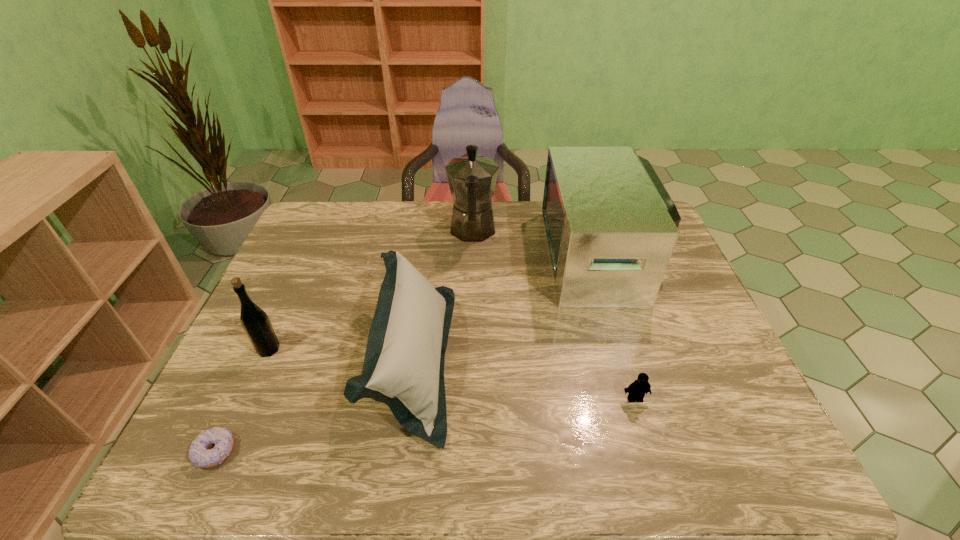
Image resolution: width=960 pixels, height=540 pixels. In order to click on unoccupied area between the beer bottle and the fifth tallest object in this screenshot , I will do `click(452, 374)`.

At what (x,y) coordinates should I click in order to perform the action: click on free space that is in between the Lego and the third shortest object. Please return your answer as a coordinate pair (x, y). Image resolution: width=960 pixels, height=540 pixels. Looking at the image, I should click on (524, 379).

Where is `empty space that is in between the doughnut and the beer bottle`? empty space that is in between the doughnut and the beer bottle is located at coordinates (242, 401).

The height and width of the screenshot is (540, 960). Identify the location of vacant area that lies between the fourth tallest object and the beer bottle. (341, 354).

Locate an element on the screen. The image size is (960, 540). free space that is in between the second shortest object and the cushion is located at coordinates (524, 379).

What are the coordinates of `free area in between the second shortest object and the beer bottle` in the screenshot? It's located at (452, 374).

This screenshot has height=540, width=960. What are the coordinates of `free space between the beer bottle and the shortest object` in the screenshot? It's located at [x=242, y=401].

Select which object is the fifth closest to the shortest object. Please provide its 2D coordinates. Your answer should be formatted as a tuple, i.e. [(x, y)], where the tuple contains the x and y coordinates of a point satisfying the conditions above.

[(636, 390)]

The height and width of the screenshot is (540, 960). What are the coordinates of `object that is the closest to the coffeepot` in the screenshot? It's located at (611, 227).